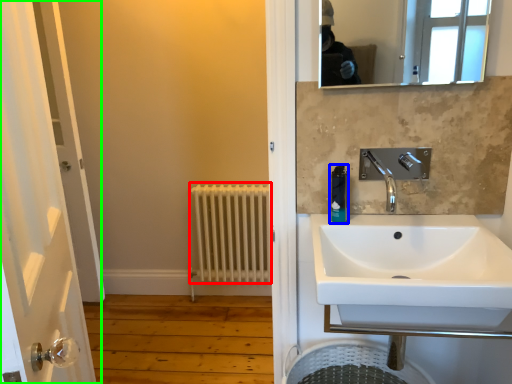
Question: Estimate the real-world distances between objects in this image. Which object is closer to radiator (highlighted by a red box), soap dispenser (highlighted by a blue box) or door (highlighted by a green box)?

Choices:
 (A) soap dispenser
 (B) door

Answer: (B)